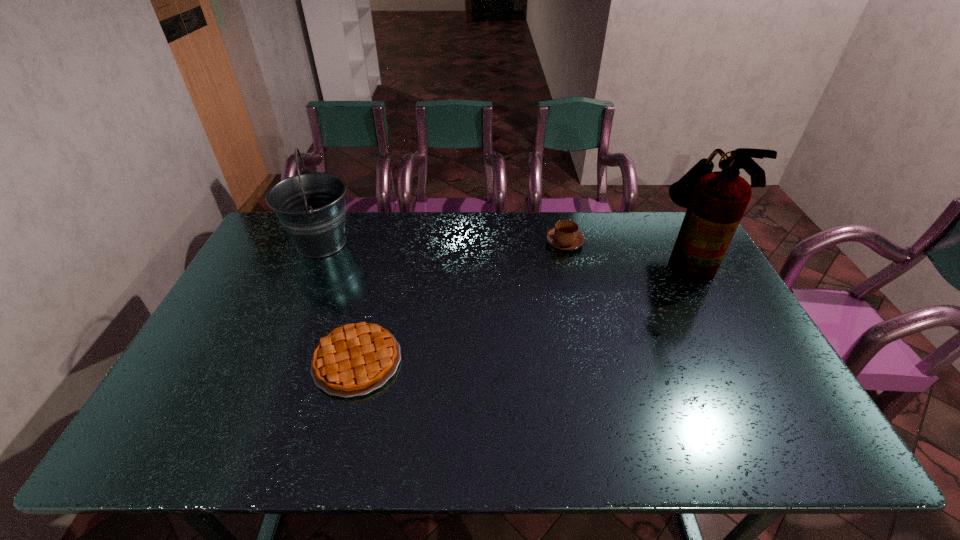
Where is `blank space located 0.360m on the front of the bucket`? The width and height of the screenshot is (960, 540). blank space located 0.360m on the front of the bucket is located at coordinates (273, 357).

Where is `free space located on the side of the third tallest object with the handle`? free space located on the side of the third tallest object with the handle is located at coordinates (559, 217).

Identify the location of vacant space located 0.130m on the front of the pie. (334, 452).

Identify the location of fire extinguisher that is at the far edge. (716, 201).

The height and width of the screenshot is (540, 960). In order to click on bucket at the far edge in this screenshot , I will do `click(311, 206)`.

Locate an element on the screen. The height and width of the screenshot is (540, 960). cappuccino at the far edge is located at coordinates click(565, 236).

Identify the location of object that is at the left edge. This screenshot has width=960, height=540. (311, 206).

Where is `object situated at the right edge`? The height and width of the screenshot is (540, 960). object situated at the right edge is located at coordinates (716, 201).

Find the location of a particular element. This screenshot has width=960, height=540. object present at the far left corner is located at coordinates (311, 206).

Where is `object at the far right corner`? The width and height of the screenshot is (960, 540). object at the far right corner is located at coordinates (716, 201).